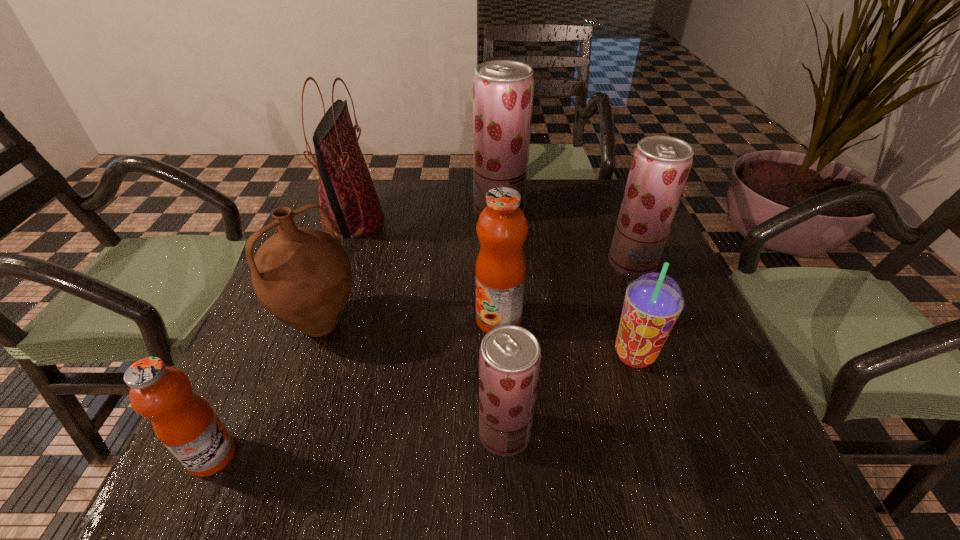
Where is `vacant space located on the back of the smallest strawberry fruit juice`? The height and width of the screenshot is (540, 960). vacant space located on the back of the smallest strawberry fruit juice is located at coordinates (502, 377).

Identify the location of vacant region located 0.290m on the front label of the smaller orange fruit juice. This screenshot has height=540, width=960. (417, 455).

Identify the location of fruit juice situated at the far edge. (503, 90).

The height and width of the screenshot is (540, 960). I want to click on handbag that is at the far edge, so click(346, 191).

You are a GUI agent. You are given a task and a screenshot of the screen. Output one action in this format:
    pyautogui.click(x=<x>, y=<y>)
    Task: Click on the handbag positioned at the left edge
    This screenshot has height=540, width=960.
    Given the screenshot: What is the action you would take?
    pyautogui.click(x=346, y=191)

Identify the location of pitcher positioned at the left edge. Image resolution: width=960 pixels, height=540 pixels. (302, 276).

In order to click on fruit juice at the left edge in this screenshot , I will do `click(184, 422)`.

What are the coordinates of `fruit juice present at the right edge` in the screenshot? It's located at point(661,164).

The width and height of the screenshot is (960, 540). Find the location of `smoothie situated at the right edge`. smoothie situated at the right edge is located at coordinates (653, 302).

I want to click on object positioned at the far left corner, so click(346, 191).